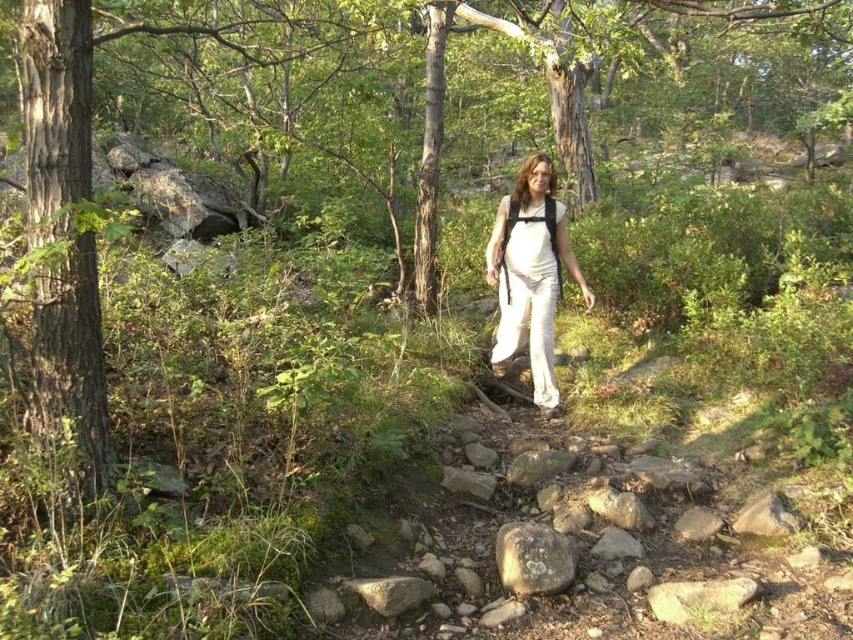
You are a hiker wearing white cotton pants at center and want to take a photo of the smooth brown tree trunk at left. Which direction should you move to frame the tree trunk in your camera?

The smooth brown tree trunk at left is positioned on the left side of white cotton pants at center. To frame the tree trunk in your camera, you should move to your left so that the smooth brown tree trunk at left comes into view.